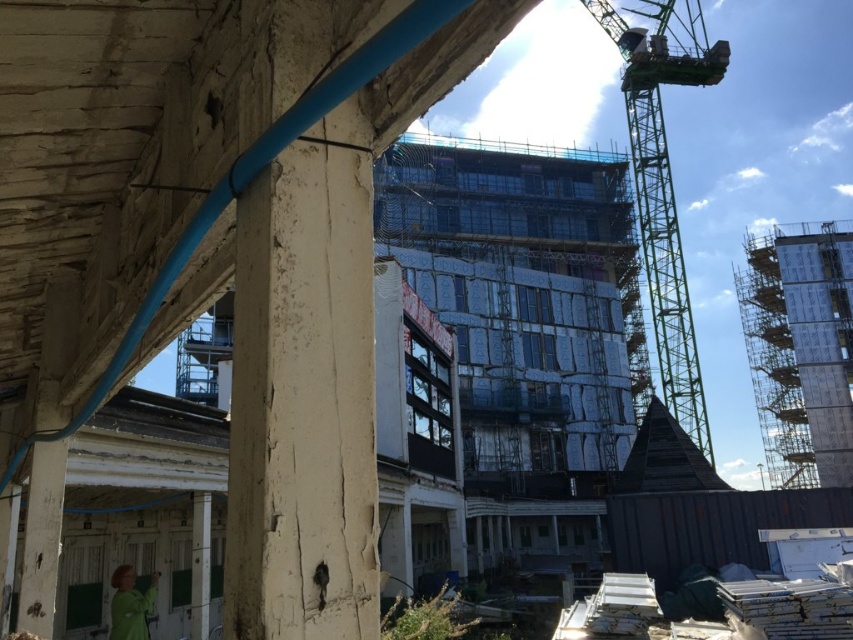
Based on the photo, you are a delivery truck driver who needs to back up your truck to the construction site. The truck requires a minimum turning radius of 100 feet to safely maneuver. Based on the scene, can you safely navigate the truck between the green metallic crane at upper right and the green fabric construction worker at lower left?

The distance between the green metallic crane at upper right and the green fabric construction worker at lower left is 121.74 feet. Since the truck requires a minimum turning radius of 100 feet, the available space is sufficient for safe navigation between these two points.

You are a safety inspector standing at the entrance of the construction site. You need to check the visibility of the green fabric construction worker at lower left and the green metallic crane at upper right. From your current position, which object is closer to you?

The green fabric construction worker at lower left is behind the green metallic crane at upper right, so the green metallic crane at upper right is closer to you.

From the picture: You are a construction supervisor observing the site. You need to move a heavy beam from the crane to the worker. Can you safely lower the beam directly between the green metallic crane at upper right and the green fabric construction worker at lower left?

The green metallic crane at upper right is positioned on the right side of the green fabric construction worker at lower left, so lowering the beam directly between them should be possible as they are positioned side by side.